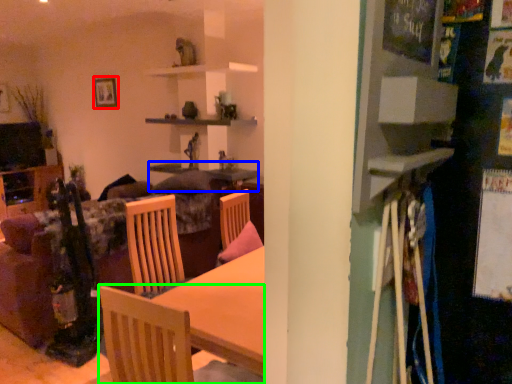
Question: Which object is positioned farthest from picture frame (highlighted by a red box)? Select from table (highlighted by a blue box) and chair (highlighted by a green box).

Choices:
 (A) table
 (B) chair

Answer: (B)